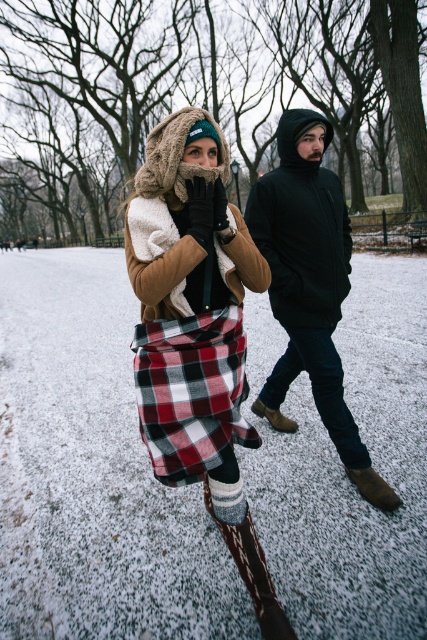
Question: Which is farther from the plaid fabric kilt at center?

Choices:
 (A) brown suede boot at lower center
 (B) plaid fabric skirt at center
 (C) black matte jacket at center

Answer: (A)

Question: Which point appears farthest from the camera in this image?

Choices:
 (A) (330, 406)
 (B) (345, 468)
 (C) (199, 392)

Answer: (B)

Question: Among these objects, which one is nearest to the camera?

Choices:
 (A) black matte jacket at center
 (B) brown suede boot at lower center
 (C) plaid fabric kilt at center
 (D) plaid fabric skirt at center

Answer: (D)

Question: Can you confirm if black matte jacket at center is bigger than plaid fabric kilt at center?

Choices:
 (A) yes
 (B) no

Answer: (A)

Question: Is black matte jacket at center above plaid fabric kilt at center?

Choices:
 (A) yes
 (B) no

Answer: (A)

Question: Is black matte jacket at center further to the viewer compared to brown suede boot at lower center?

Choices:
 (A) no
 (B) yes

Answer: (A)